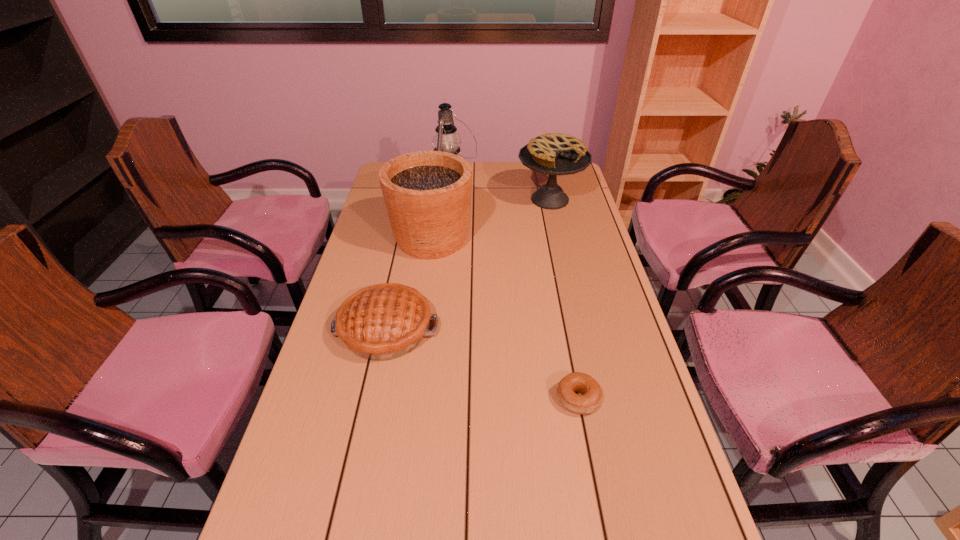
The image size is (960, 540). What are the coordinates of `vacant space at the far edge of the desktop` in the screenshot? It's located at (494, 174).

Where is `free location at the left edge`? free location at the left edge is located at coordinates (378, 253).

Where is `vacant space at the right edge of the desktop`? This screenshot has width=960, height=540. vacant space at the right edge of the desktop is located at coordinates (635, 339).

In the image, there is a desktop. Identify the location of free space at the far right corner. Image resolution: width=960 pixels, height=540 pixels. (563, 185).

At what (x,y) coordinates should I click in order to perform the action: click on unoccupied position between the taller pie and the nearer pie. Please return your answer as a coordinate pair (x, y). This screenshot has width=960, height=540. Looking at the image, I should click on coord(468,264).

Locate an element on the screen. The width and height of the screenshot is (960, 540). free point between the nearer pie and the flowerpot is located at coordinates (409, 284).

The image size is (960, 540). What are the coordinates of `free space between the nearer pie and the flowerpot` in the screenshot? It's located at (409, 284).

This screenshot has width=960, height=540. Identify the location of empty space that is in between the flowerpot and the taller pie. (491, 219).

You are a GUI agent. You are given a task and a screenshot of the screen. Output one action in this format:
    pyautogui.click(x=<x>, y=<y>)
    Task: Click on the vacant point located between the taller pie and the shorter pie
    Image resolution: width=960 pixels, height=540 pixels.
    Given the screenshot: What is the action you would take?
    pyautogui.click(x=468, y=264)

Where is `vacant area between the nearest object and the oil lamp`? The width and height of the screenshot is (960, 540). vacant area between the nearest object and the oil lamp is located at coordinates point(515,287).